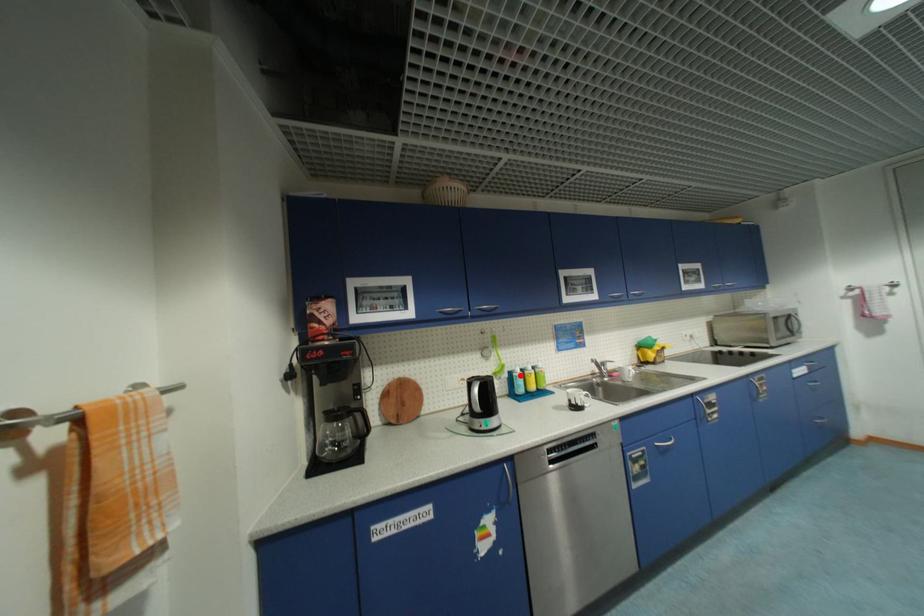
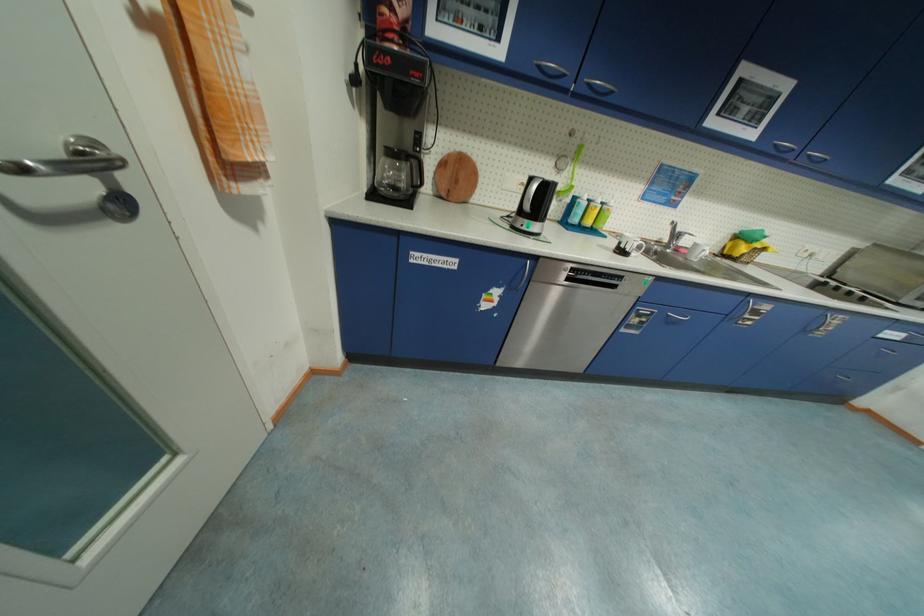
Find the pixel in the second image that matches the highlighted location in the first image.

(584, 201)